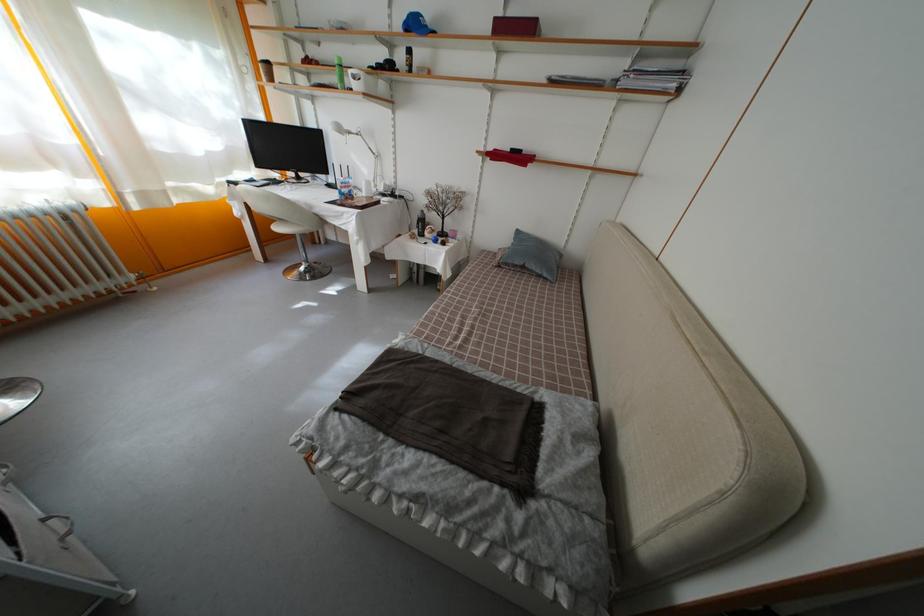
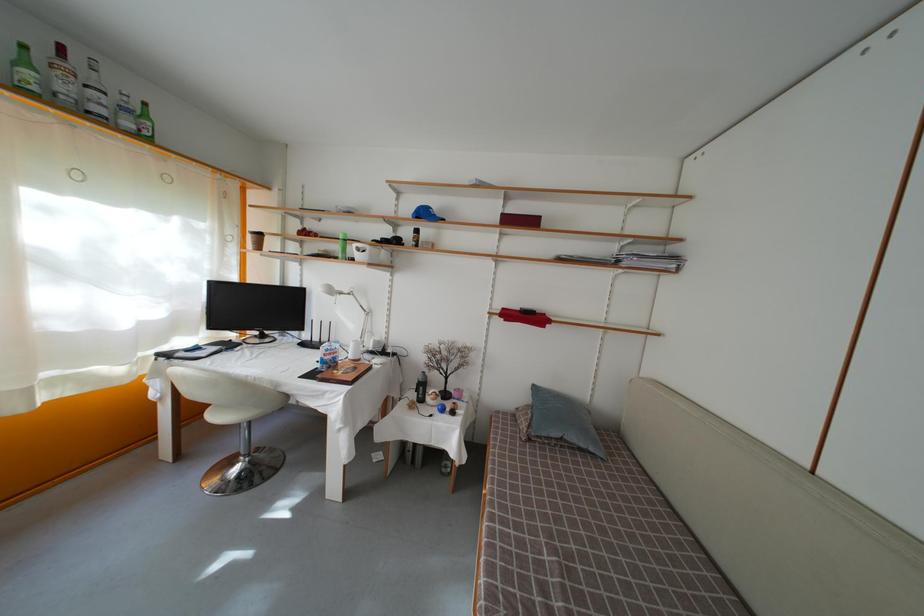
The point at (516, 276) is marked in the first image. Where is the corresponding point in the second image?

(550, 450)